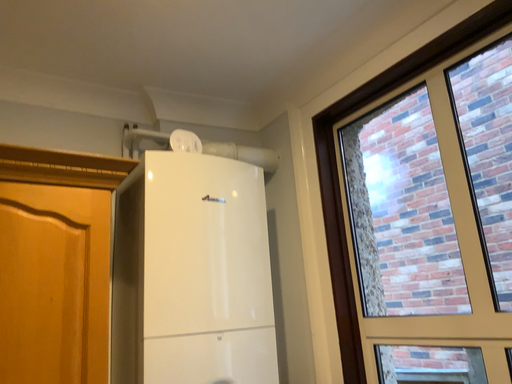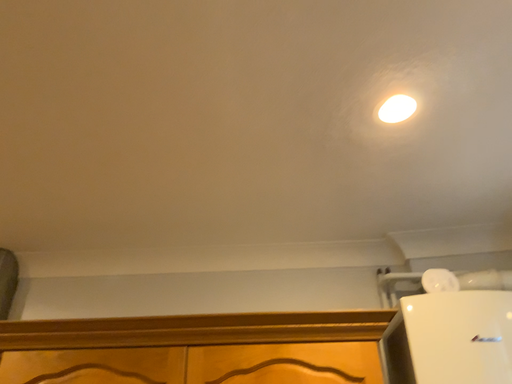
Question: Which way did the camera rotate in the video?

Choices:
 (A) rotated left
 (B) rotated right

Answer: (A)